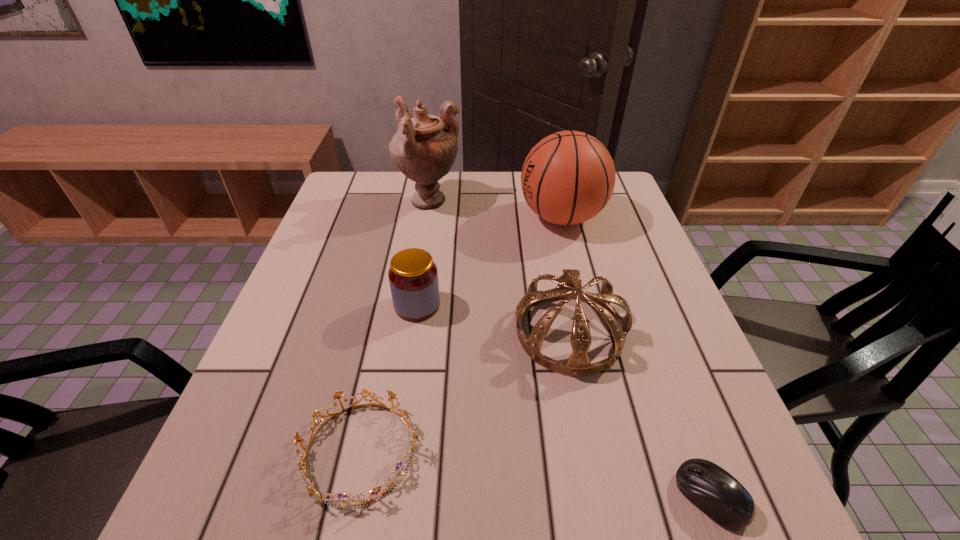
This screenshot has width=960, height=540. Find the location of `free space between the second shortest object and the right tiara`. free space between the second shortest object and the right tiara is located at coordinates (465, 392).

Where is `vacant region between the tallest object and the basketball`? The image size is (960, 540). vacant region between the tallest object and the basketball is located at coordinates (495, 210).

The image size is (960, 540). I want to click on object that stands as the fourth closest to the mouse, so click(567, 178).

Image resolution: width=960 pixels, height=540 pixels. I want to click on object that is the closest one to the mouse, so click(569, 286).

Image resolution: width=960 pixels, height=540 pixels. I want to click on vacant region that satisfies the following two spatial constraints: 1. on the front side of the fourth tallest object; 2. on the front-facing side of the left tiara, so click(396, 451).

Find the location of a particular element. free spot that satisfies the following two spatial constraints: 1. on the surface of the second tallest object near the brand logo; 2. on the left side of the shortest object is located at coordinates (629, 496).